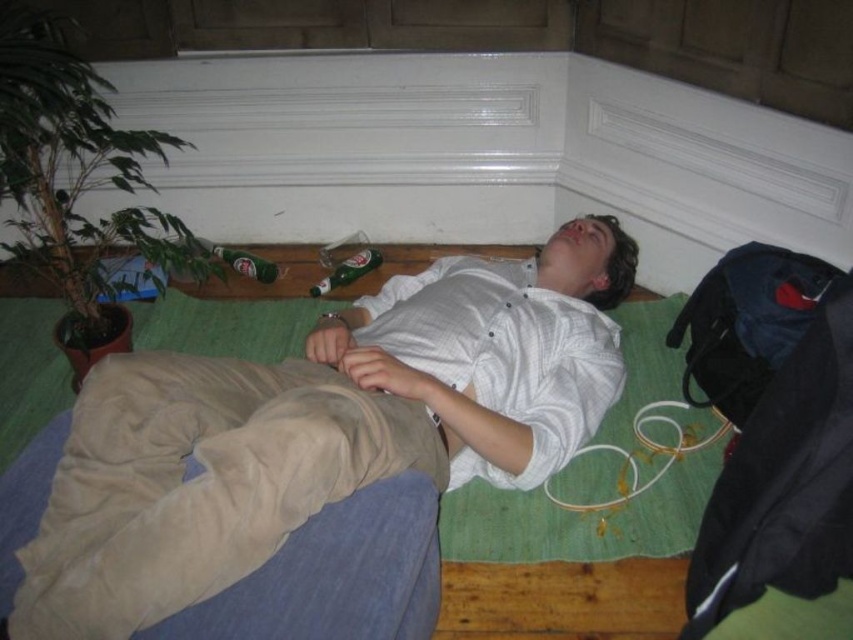
You are a drone operator trying to capture a closeup of the person in the scene. You have two points marked for potential camera positions. The first is at point (370, 358) and the second is at point (235, 262). Which point would allow the drone to get a closer shot of the person?

Point (370, 358) is closer to the viewer than point (235, 262), so the drone should use point (370, 358) to get a closer shot of the person.